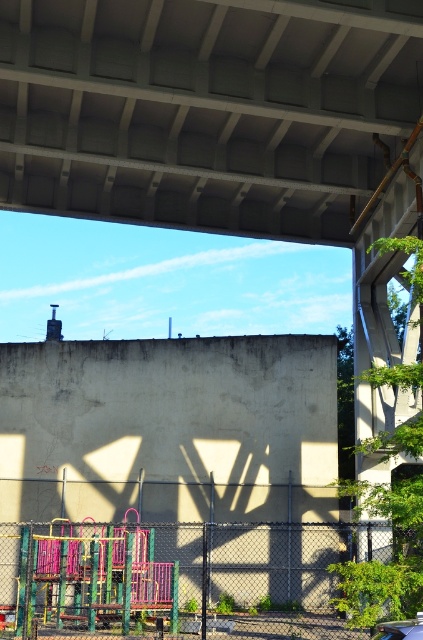
Who is taller, concrete at center or metallic playground equipment at lower left?

concrete at center

Is concrete at center closer to the viewer compared to metallic playground equipment at lower left?

Yes, concrete at center is closer to the viewer.

Which is behind, point (118, 58) or point (202, 355)?

The point (202, 355) is more distant.

Image resolution: width=423 pixels, height=640 pixels. I want to click on concrete at center, so click(206, 109).

Does concrete at center appear on the left side of green chain-link fence at lower center?

No, concrete at center is not to the left of green chain-link fence at lower center.

This screenshot has width=423, height=640. What do you see at coordinates (206, 109) in the screenshot? I see `concrete at center` at bounding box center [206, 109].

In order to click on concrete at center in this screenshot , I will do `click(206, 109)`.

Between concrete at center and shiny black car at lower right, which one appears on the right side from the viewer's perspective?

shiny black car at lower right is more to the right.

What are the coordinates of `concrete at center` in the screenshot? It's located at 206,109.

Identify the location of concrete at center. The image size is (423, 640). click(206, 109).

Identify the location of concrete at center. The image size is (423, 640). (206, 109).